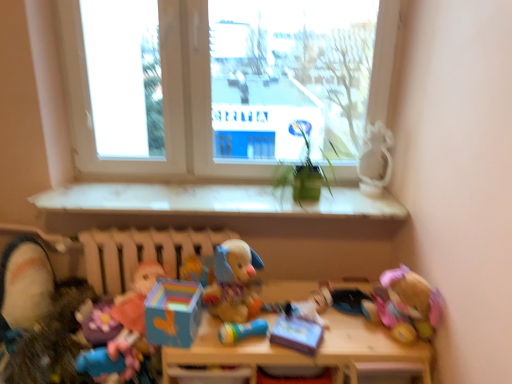
The height and width of the screenshot is (384, 512). Find the location of `free location to the left of green matte plant at center`. free location to the left of green matte plant at center is located at coordinates (238, 200).